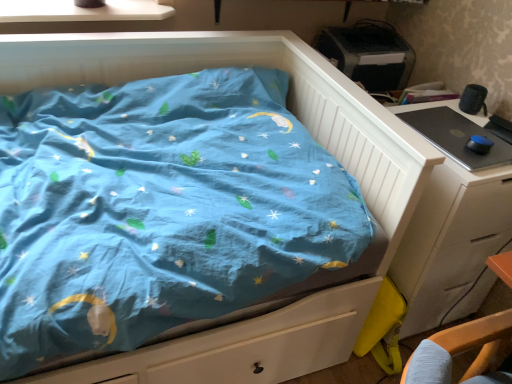
Question: From the image's perspective, is white glossy window sill at upper left positioned above or below black glossy desktop at right?

Choices:
 (A) above
 (B) below

Answer: (A)

Question: From their relative heights in the image, would you say white glossy window sill at upper left is taller or shorter than black glossy desktop at right?

Choices:
 (A) short
 (B) tall

Answer: (B)

Question: Estimate the real-world distances between objects in this image. Which object is closer to the black glossy desktop at right?

Choices:
 (A) white glossy window sill at upper left
 (B) white wood chest of drawers at right

Answer: (B)

Question: Considering the real-world distances, which object is farthest from the white glossy window sill at upper left?

Choices:
 (A) black glossy desktop at right
 (B) white wood chest of drawers at right

Answer: (B)